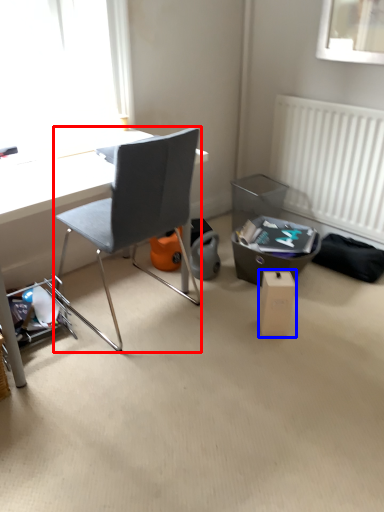
Question: Which object appears closest to the camera in this image, chair (highlighted by a red box) or cardboard box (highlighted by a blue box)?

Choices:
 (A) chair
 (B) cardboard box

Answer: (A)